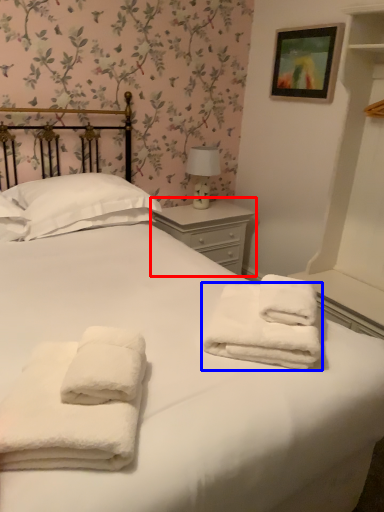
Question: Which object appears farthest to the camera in this image, nightstand (highlighted by a red box) or towel (highlighted by a blue box)?

Choices:
 (A) nightstand
 (B) towel

Answer: (A)